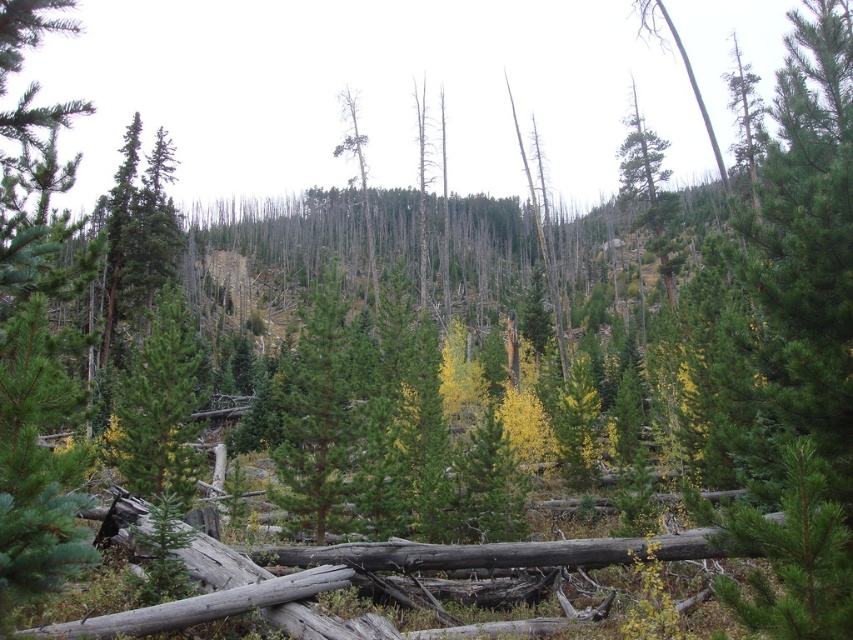
Question: Does green matte tree at center have a lesser width compared to green matte tree at upper right?

Choices:
 (A) no
 (B) yes

Answer: (B)

Question: Which object is positioned farthest from the green matte tree at center?

Choices:
 (A) dead wood at center
 (B) green matte tree at upper right

Answer: (B)

Question: Which object appears closest to the camera in this image?

Choices:
 (A) green matte tree at center
 (B) dead wood at center
 (C) green matte tree at upper right

Answer: (A)

Question: Considering the relative positions of green matte tree at center and dead wood at center in the image provided, where is green matte tree at center located with respect to dead wood at center?

Choices:
 (A) right
 (B) left

Answer: (A)

Question: Does green matte tree at center appear on the left side of green matte tree at upper right?

Choices:
 (A) yes
 (B) no

Answer: (A)

Question: Among these points, which one is farthest from the camera?

Choices:
 (A) (344, 305)
 (B) (354, 150)
 (C) (657, 189)

Answer: (B)